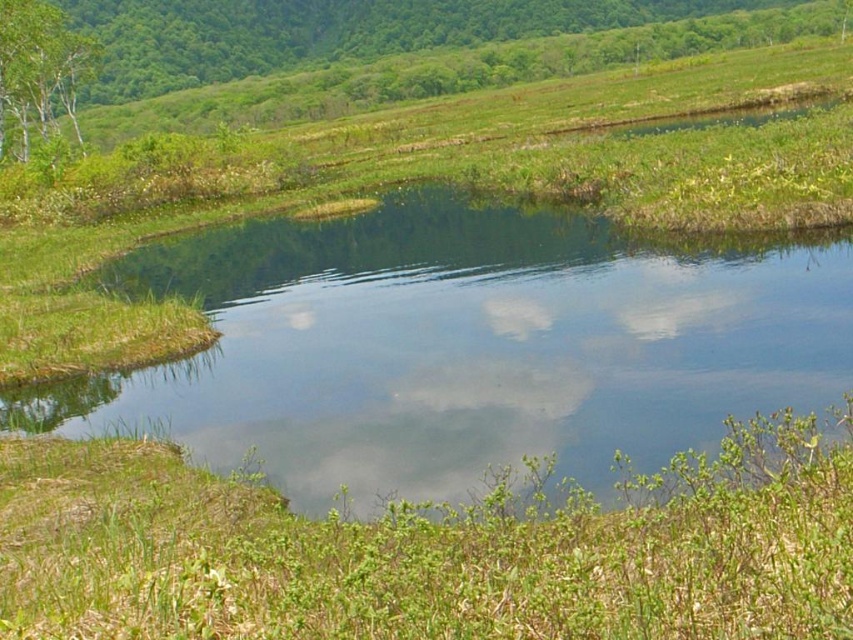
Which is more to the right, green leafy tree at upper center or green matte tree at upper left?

green leafy tree at upper center is more to the right.

Does green leafy tree at upper center have a greater height compared to green matte tree at upper left?

No, green leafy tree at upper center is not taller than green matte tree at upper left.

Which is behind, point (310, 90) or point (28, 109)?

The point (310, 90) is behind.

Find the location of a particular element. This screenshot has width=853, height=640. green leafy tree at upper center is located at coordinates (451, 72).

Can you confirm if clear water at center is taller than green matte tree at upper left?

No.

Looking at this image, who is taller, clear water at center or green matte tree at upper left?

green matte tree at upper left

Where is `clear water at center`? This screenshot has height=640, width=853. clear water at center is located at coordinates (463, 346).

Looking at this image, does green leafy grass at lower center have a larger size compared to green leafy tree at upper center?

No, green leafy grass at lower center is not bigger than green leafy tree at upper center.

Does point (35, 573) come closer to viewer compared to point (746, 16)?

Yes.

This screenshot has height=640, width=853. I want to click on green leafy grass at lower center, so click(x=432, y=552).

Locate an element on the screen. This screenshot has height=640, width=853. green leafy grass at lower center is located at coordinates (x=432, y=552).